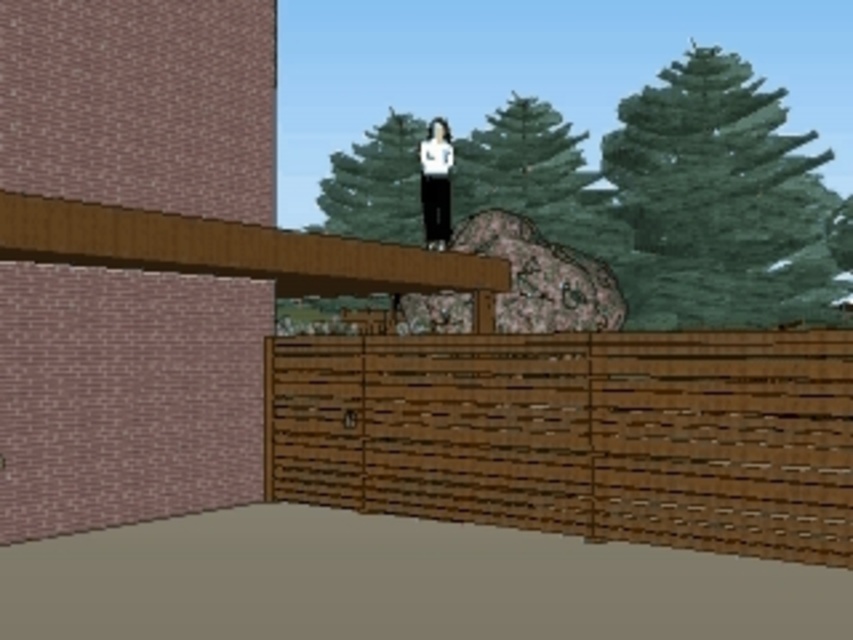
Does brown wooden fence at center have a greater width compared to white matte pants at center?

Incorrect, brown wooden fence at center's width does not surpass white matte pants at center's.

Who is more forward, (599, 365) or (422, 166)?

Positioned in front is point (599, 365).

Is point (663, 529) farther from camera compared to point (450, 163)?

No, (663, 529) is closer to viewer.

Identify the location of brown wooden fence at center. This screenshot has height=640, width=853. (577, 435).

Between brown wooden fence at center and rustic stone at center, which one is positioned higher?

rustic stone at center is higher up.

Is brown wooden fence at center positioned in front of rustic stone at center?

Yes, it is in front of rustic stone at center.

Where is `brown wooden fence at center`? brown wooden fence at center is located at coordinates (577, 435).

Who is taller, rustic stone at center or white matte pants at center?

rustic stone at center

Can you confirm if rustic stone at center is positioned to the right of white matte pants at center?

Indeed, rustic stone at center is positioned on the right side of white matte pants at center.

Find the location of a particular element. The height and width of the screenshot is (640, 853). rustic stone at center is located at coordinates (541, 276).